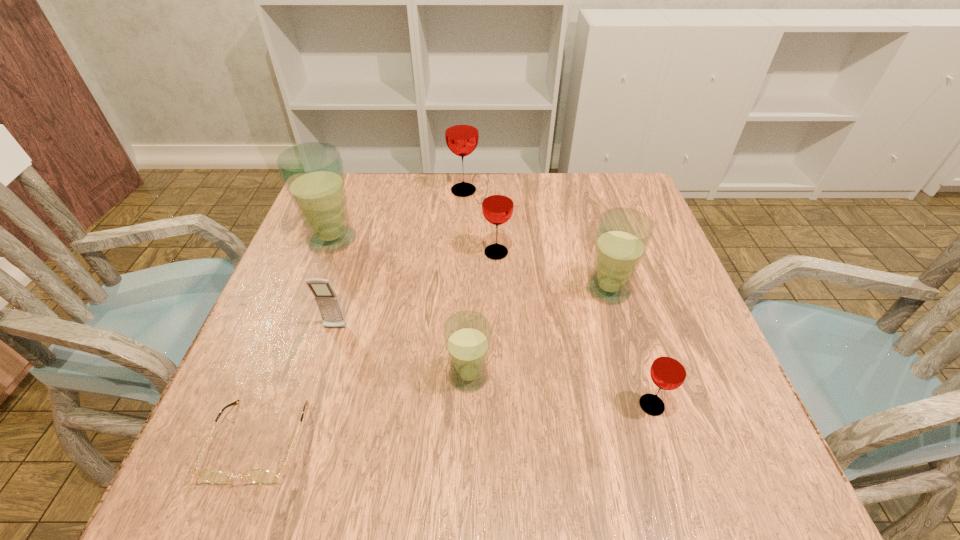
Find the location of a particular element. Image resolution: width=960 pixels, height=540 pixels. free space between the green spectacles and the leftmost blue glass is located at coordinates (296, 340).

The height and width of the screenshot is (540, 960). In order to click on free space between the smallest red glass and the gray cellular telephone in this screenshot , I will do tap(493, 367).

This screenshot has height=540, width=960. I want to click on unoccupied position between the second smallest blue glass and the nearest blue glass, so click(x=539, y=333).

Choose which object is the second nearest neighbor to the second farthest blue glass. Please provide its 2D coordinates. Your answer should be formatted as a tuple, i.e. [(x, y)], where the tuple contains the x and y coordinates of a point satisfying the conditions above.

[(668, 371)]

Identify which object is the second closest to the smallest red glass. Please provide its 2D coordinates. Your answer should be formatted as a tuple, i.e. [(x, y)], where the tuple contains the x and y coordinates of a point satisfying the conditions above.

[(467, 334)]

Identify which glass is located as the fourth nearest to the fourth nearest object. Please provide its 2D coordinates. Your answer should be formatted as a tuple, i.e. [(x, y)], where the tuple contains the x and y coordinates of a point satisfying the conditions above.

[(461, 126)]

Locate which glass is the second closest to the second farthest blue glass. Please provide its 2D coordinates. Your answer should be formatted as a tuple, i.e. [(x, y)], where the tuple contains the x and y coordinates of a point satisfying the conditions above.

[(668, 371)]

The width and height of the screenshot is (960, 540). Find the location of `red glass that stands as the closest to the gray cellular telephone`. red glass that stands as the closest to the gray cellular telephone is located at coordinates (497, 207).

Find the location of a particular element. This screenshot has height=540, width=960. red glass that is the second nearest to the cellular telephone is located at coordinates (461, 126).

Identify the location of blue glass that is the second closest to the fifth nearest object. (313, 173).